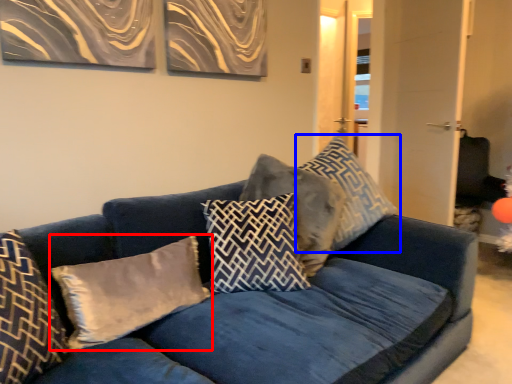
Question: Which of the following is the farthest to the observer, pillow (highlighted by a red box) or pillow (highlighted by a blue box)?

Choices:
 (A) pillow
 (B) pillow

Answer: (B)